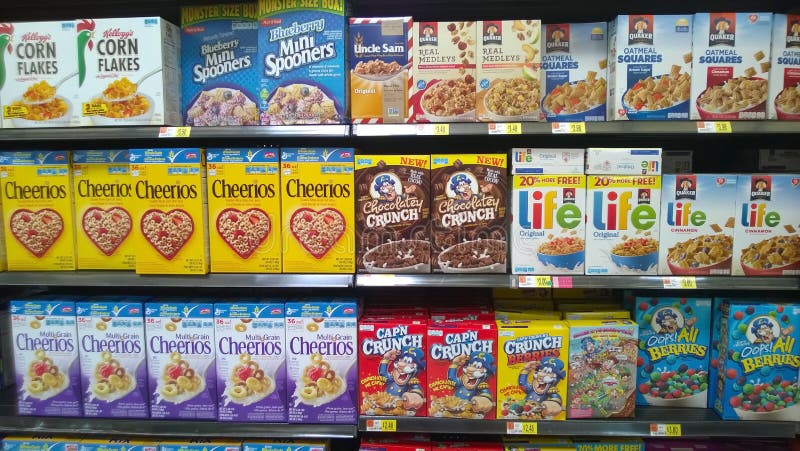
Where is `cereal on the lowest shelf`? The height and width of the screenshot is (451, 800). cereal on the lowest shelf is located at coordinates (37, 444), (112, 443), (201, 444), (270, 444), (402, 446), (454, 441), (532, 441), (613, 446), (673, 446), (754, 443).